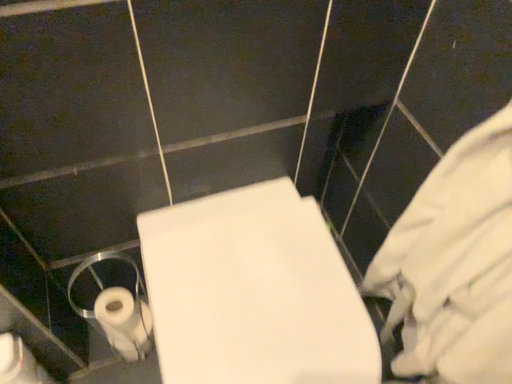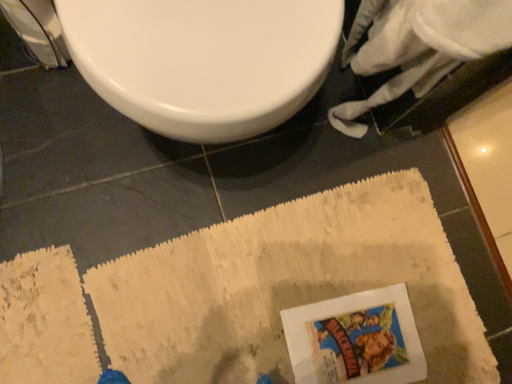
Question: How did the camera likely rotate when shooting the video?

Choices:
 (A) rotated downward
 (B) rotated upward

Answer: (A)